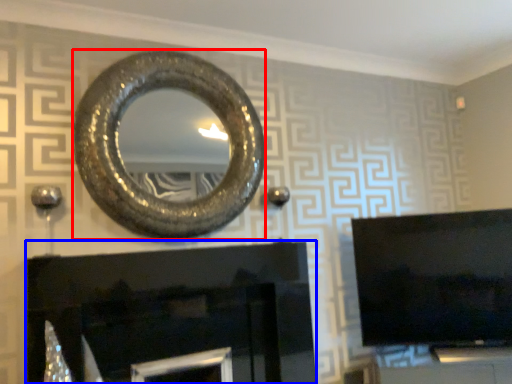
Question: Which of the following is the farthest to the observer, oval (highlighted by a red box) or fireplace (highlighted by a blue box)?

Choices:
 (A) oval
 (B) fireplace

Answer: (A)